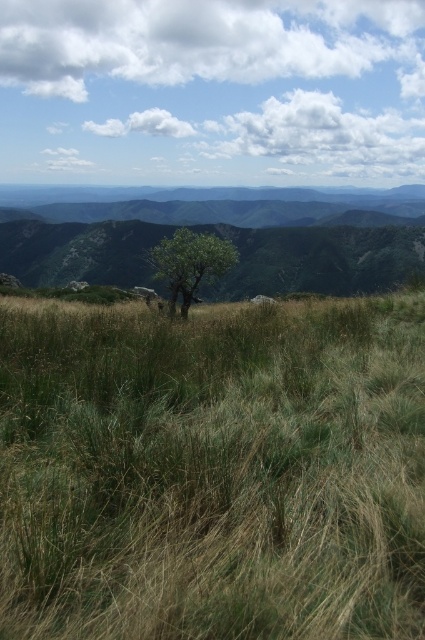
You are a hiker standing at the edge of the green grassy at center and looking towards the green grassy hill at center. Which one is closer to your feet?

The green grassy at center is closer to your feet because it is positioned below the green grassy hill at center, meaning it is nearer to the observer.

You are standing in the middle of the grassy terrain and want to walk towards the two points marked in the image. Which point, point (396, 189) or point (175, 268), will you reach first?

You will reach point (175, 268) first because it is closer to you than point (396, 189), which is further away.